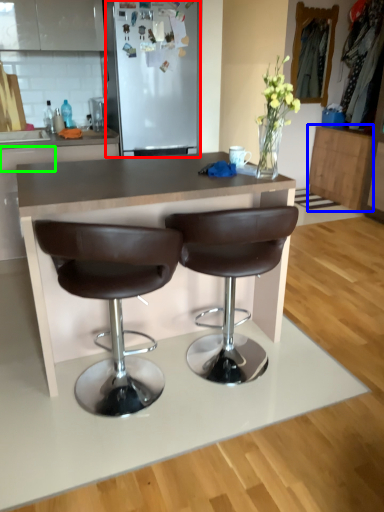
Question: Considering the real-world distances, which object is closest to fridge (highlighted by a red box)? cabinetry (highlighted by a blue box) or drawer (highlighted by a green box).

Choices:
 (A) cabinetry
 (B) drawer

Answer: (B)